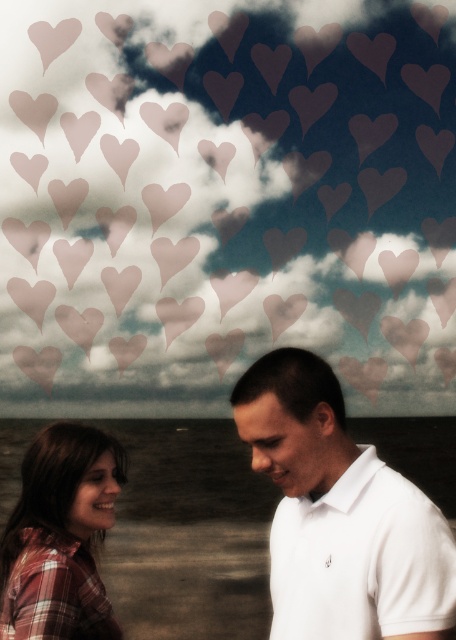
Based on the photo, you are a photographer trying to capture a closeup of the white cotton polo shirt at center. Based on its position, where should you aim your camera to ensure it is centered in the frame?

To center the white cotton polo shirt at center in the frame, aim your camera at the coordinates point (340, 515).

You are a photographer trying to capture a candid shot of both the white cotton polo shirt at center and the plaid fabric shirt at lower left. Since you want to ensure both are fully visible in the frame, which person should you focus on adjusting the camera angle towards?

The white cotton polo shirt at center is much taller than the plaid fabric shirt at lower left. To ensure both are fully visible, you should focus on adjusting the camera angle towards the white cotton polo shirt at center to capture its full height while still including the plaid fabric shirt at lower left in the frame.